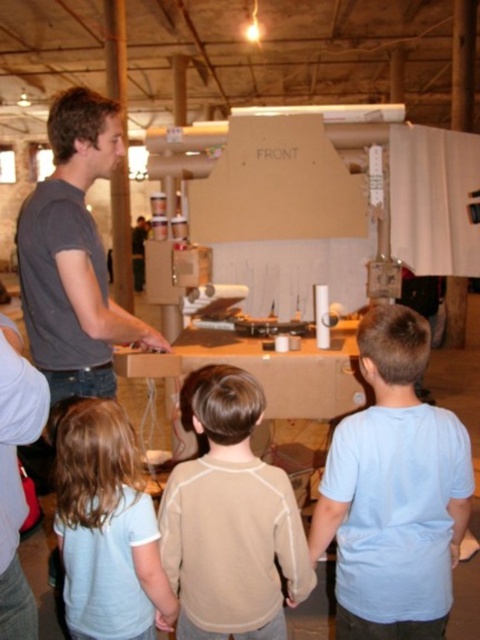
Question: Among these points, which one is nearest to the camera?

Choices:
 (A) (176, 506)
 (B) (450, 464)
 (C) (157, 577)

Answer: (B)

Question: Does beige fleece sweater at center come in front of light blue shirt at lower left?

Choices:
 (A) no
 (B) yes

Answer: (B)

Question: Can you confirm if light blue cotton shirt at center is positioned to the left of light blue shirt at lower left?

Choices:
 (A) no
 (B) yes

Answer: (A)

Question: Which point is closer to the camera taking this photo?

Choices:
 (A) (160, 604)
 (B) (257, 384)

Answer: (B)

Question: Observing the image, what is the correct spatial positioning of light blue cotton shirt at center in reference to light blue shirt at lower left?

Choices:
 (A) left
 (B) right

Answer: (B)

Question: Which point is farther from the camera taking this photo?

Choices:
 (A) (278, 468)
 (B) (122, 572)

Answer: (B)